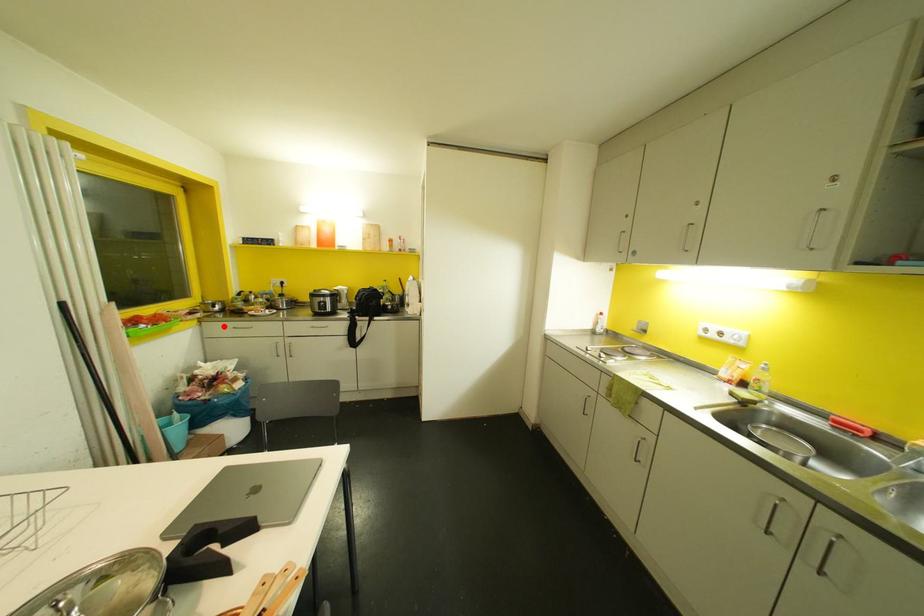
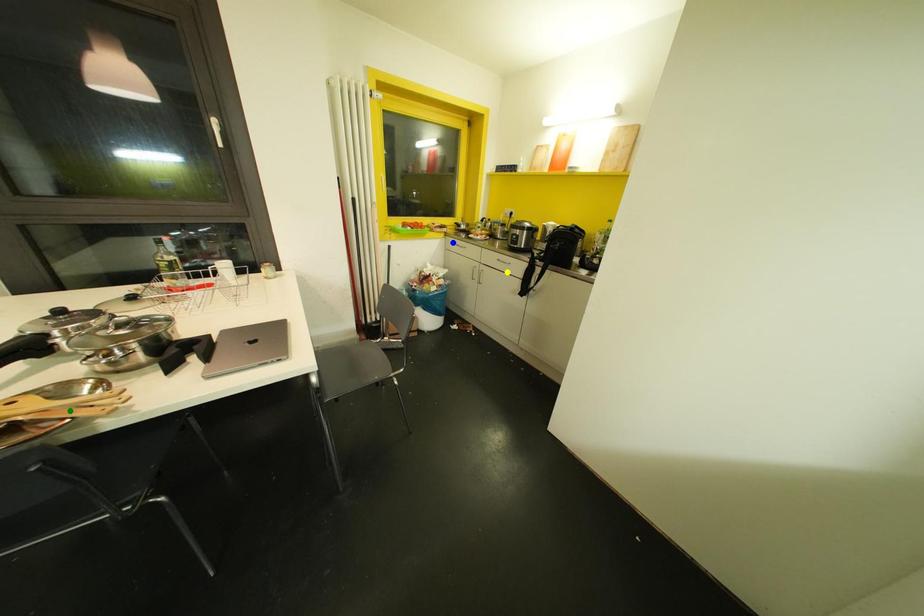
Question: I am providing you with two images of the same scene from different viewpoints. A red point is marked on the first image. You are given multiple points on the second image. Can you choose the point in image 2 that corresponds to the point in image 1?

Choices:
 (A) blue point
 (B) green point
 (C) yellow point

Answer: (A)